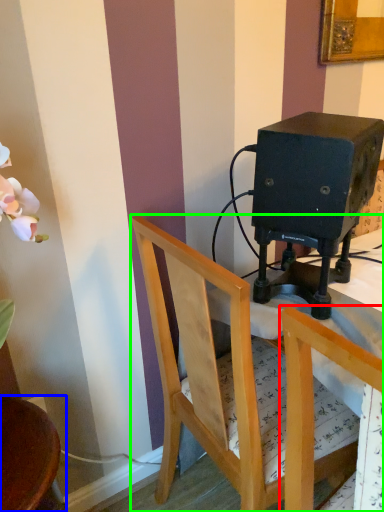
Question: Which object is the farthest from chair (highlighted by a red box)? Choose among these: chair (highlighted by a blue box) or chair (highlighted by a green box).

Choices:
 (A) chair
 (B) chair

Answer: (A)